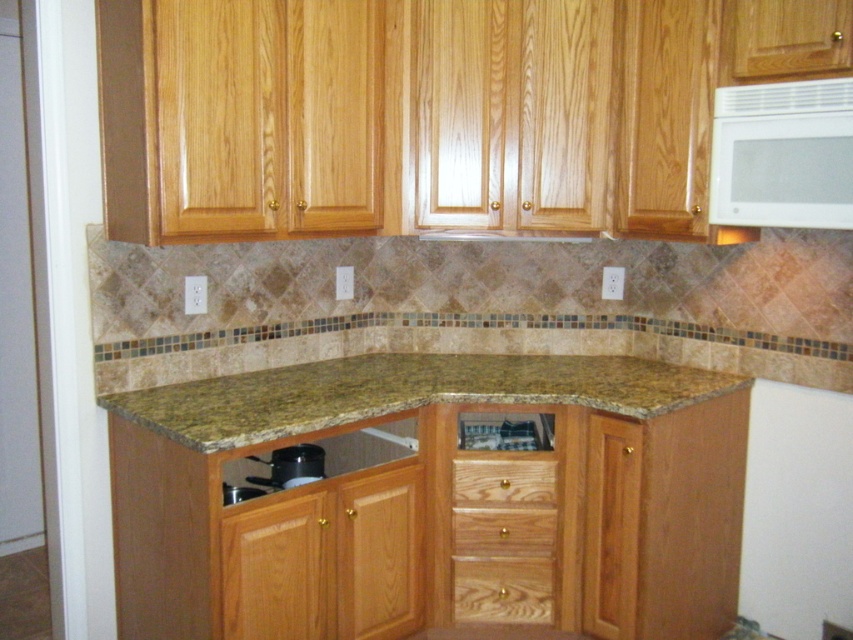
What do you see at coordinates (502, 589) in the screenshot? The height and width of the screenshot is (640, 853). I see `wooden at lower center` at bounding box center [502, 589].

Who is more distant from viewer, (463, 582) or (466, 445)?

Positioned behind is point (466, 445).

I want to click on wooden at lower center, so click(502, 589).

You are a GUI agent. You are given a task and a screenshot of the screen. Output one action in this format:
    pyautogui.click(x=<x>, y=<y>)
    Task: Click on the wooden at lower center
    This screenshot has height=640, width=853.
    Given the screenshot: What is the action you would take?
    pyautogui.click(x=502, y=589)

Is yellow-green granite countertop at center smaller than satin silver dishwasher at lower center?

No.

Can you confirm if yellow-green granite countertop at center is positioned above satin silver dishwasher at lower center?

Indeed, yellow-green granite countertop at center is positioned over satin silver dishwasher at lower center.

Does point (532, 364) come in front of point (546, 428)?

No, (532, 364) is further to viewer.

Where is `yellow-green granite countertop at center`? yellow-green granite countertop at center is located at coordinates (404, 392).

Is point (532, 520) positioned behind point (287, 481)?

Yes.

Who is lower down, light brown wood drawer at lower center or black matte pot at lower center?

light brown wood drawer at lower center is below.

Is point (546, 547) closer to camera compared to point (289, 445)?

No, it is behind (289, 445).

This screenshot has width=853, height=640. I want to click on light brown wood drawer at lower center, so click(502, 531).